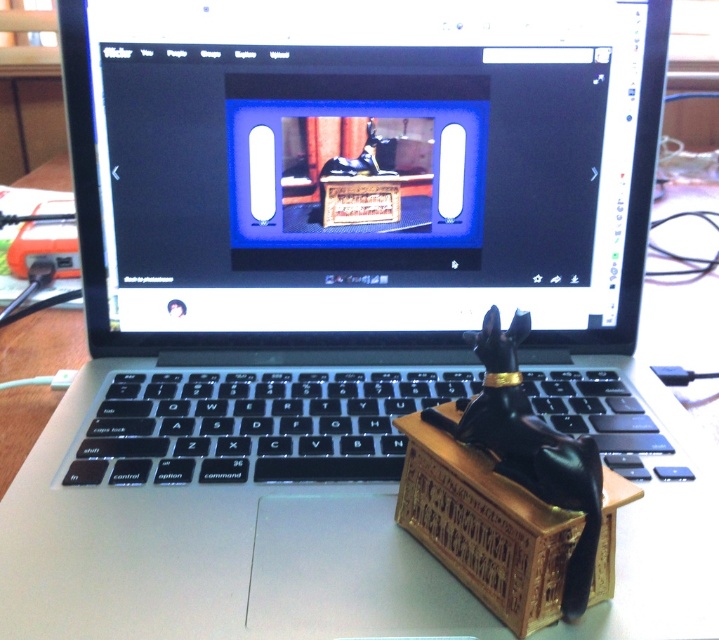
Between black glossy monitor at center and black plastic keyboard at center, which one has more height?

With more height is black glossy monitor at center.

Between black glossy monitor at center and black plastic keyboard at center, which one is positioned lower?

black plastic keyboard at center is lower down.

Is point (201, 220) positioned after point (388, 376)?

No, it is not.

Where is `black glossy monitor at center`? The height and width of the screenshot is (640, 719). black glossy monitor at center is located at coordinates (361, 168).

Does black plastic keyboard at center have a greater height compared to blue glossy frame at center?

No, black plastic keyboard at center is not taller than blue glossy frame at center.

Is black plastic keyboard at center in front of blue glossy frame at center?

Yes, black plastic keyboard at center is closer to the viewer.

Identify the location of black plastic keyboard at center. (255, 426).

Does black glossy monitor at center appear on the left side of blue glossy frame at center?

Incorrect, black glossy monitor at center is not on the left side of blue glossy frame at center.

Which is in front, point (494, 109) or point (298, 131)?

Point (494, 109)

Describe the element at coordinates (361, 168) in the screenshot. I see `black glossy monitor at center` at that location.

Where is `black glossy monitor at center`? The image size is (719, 640). black glossy monitor at center is located at coordinates (361, 168).